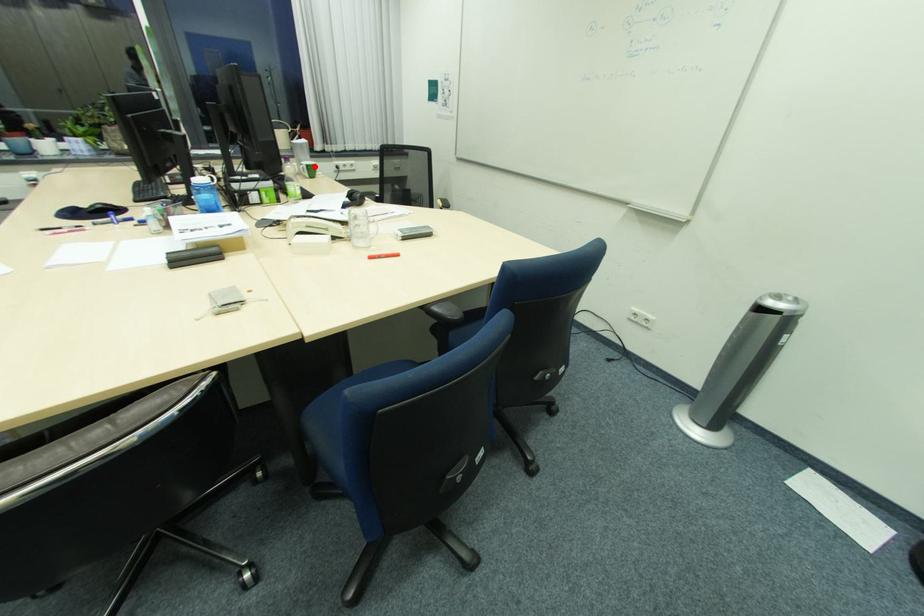
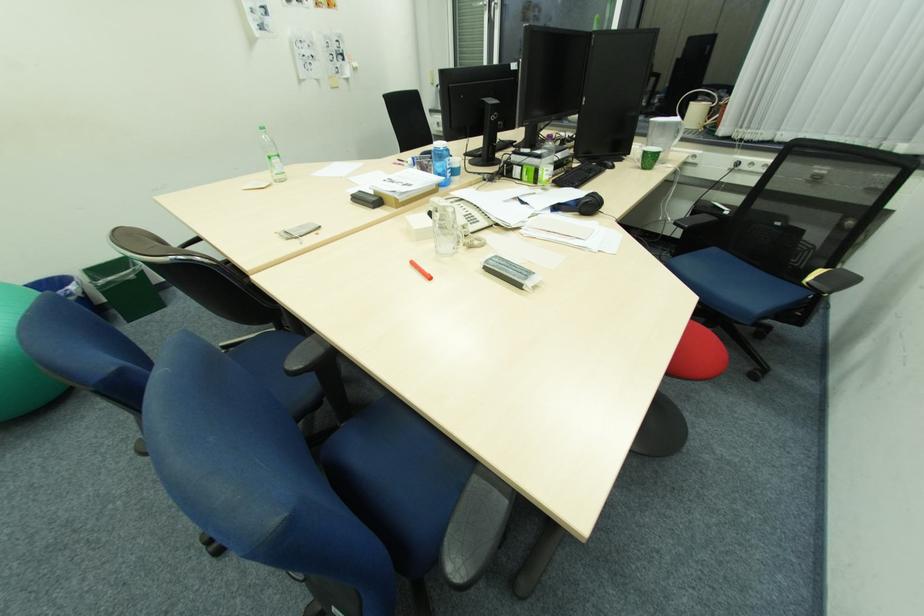
Locate, in the second image, the point that corresponds to the highlighted location in the first image.

(650, 153)